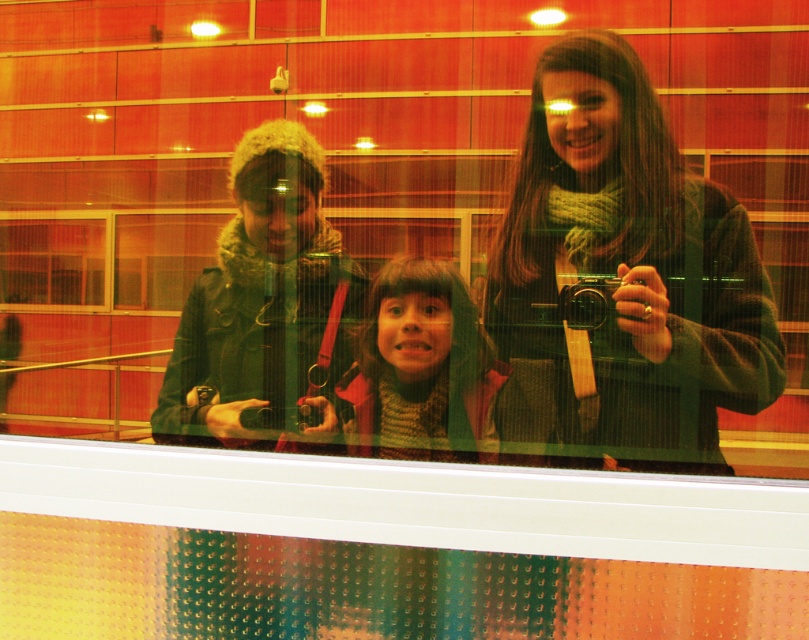
You are organizing a charity event and need to display two items on a shelf. The matte green jacket at left and the green knitted sweater at center must be placed side by side. Which item should you place on the left side of the shelf to ensure they fit without overlapping?

The matte green jacket at left should be placed on the left side of the shelf because it is larger in size than the green knitted sweater at center, allowing both items to fit without overlapping.